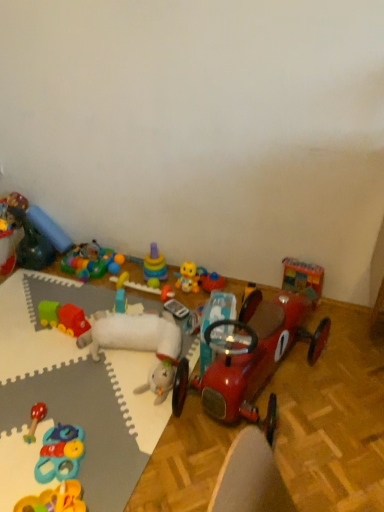
What are the coordinates of `free space in front of rubber green and red train at lower left, marked as the 4th toy in a left-to-right arrangement` in the screenshot? It's located at tap(55, 354).